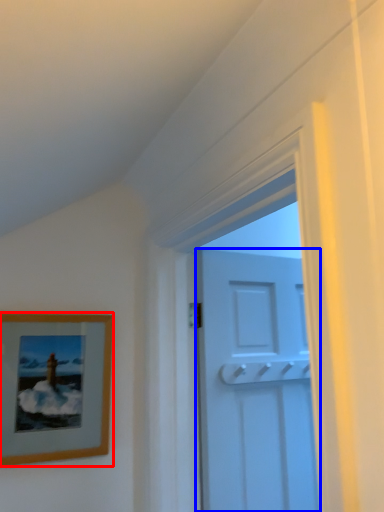
Question: Which point is closer to the camera, picture frame (highlighted by a red box) or door (highlighted by a blue box)?

Choices:
 (A) picture frame
 (B) door

Answer: (A)